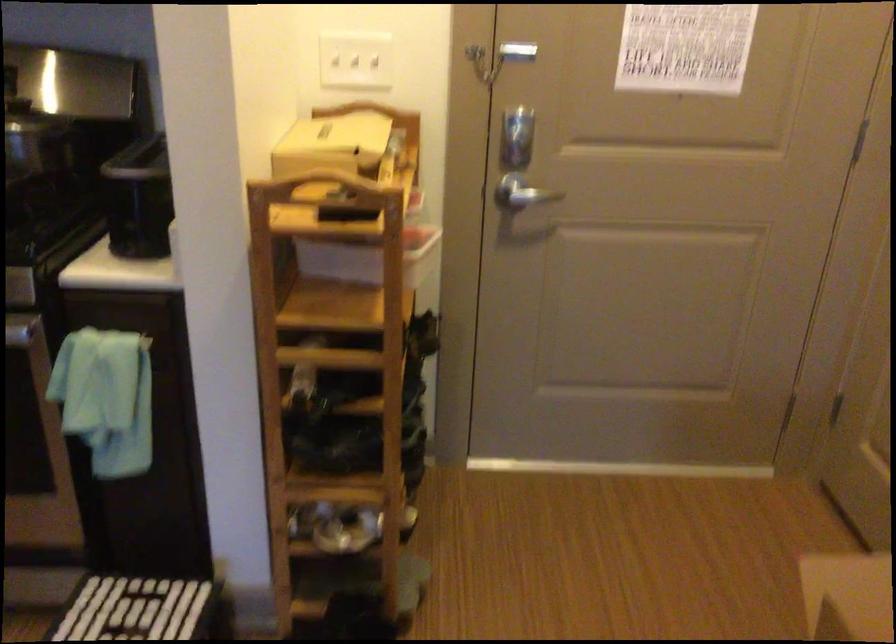
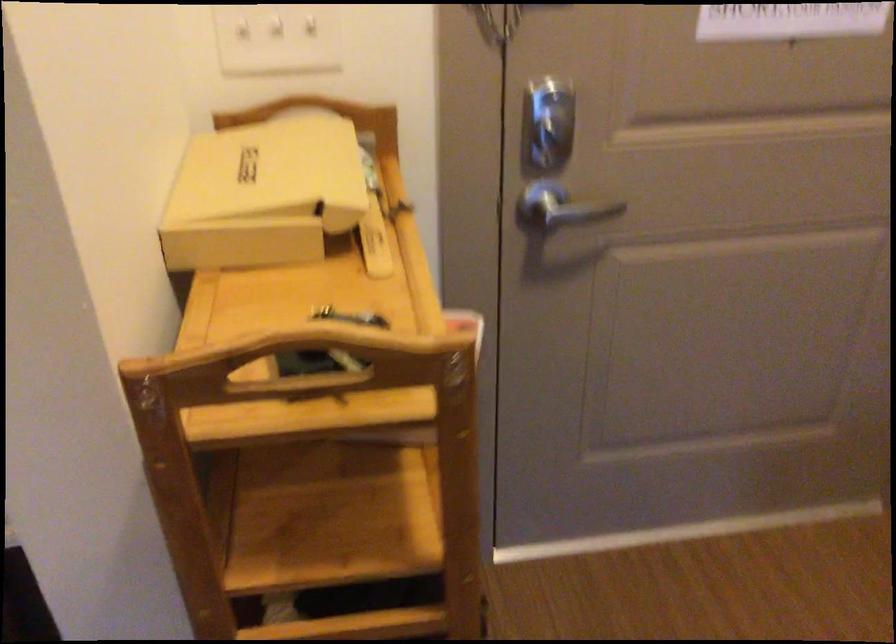
Question: The camera is either moving clockwise (left) or counter-clockwise (right) around the object. The first image is from the beginning of the video and the second image is from the end. Is the camera moving left or right when shooting the video?

Choices:
 (A) Left
 (B) Right

Answer: (A)